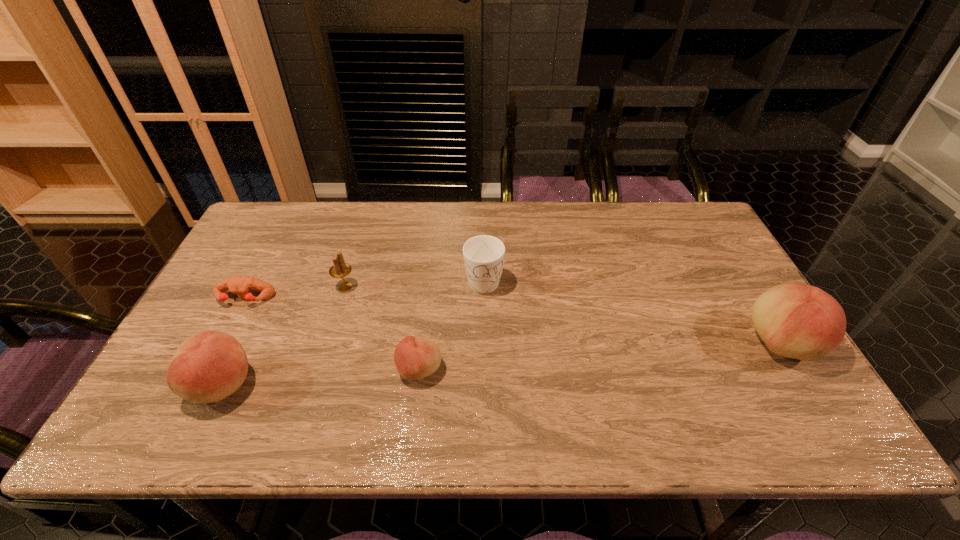
The width and height of the screenshot is (960, 540). Identify the location of vacant space that satisfies the following two spatial constraints: 1. with the gloves of the shortest peach facing forward; 2. on the right side of the shortest object. (207, 370).

What are the coordinates of `free space that satisfies the following two spatial constraints: 1. on the back side of the third object from right to left; 2. on the left side of the second tallest peach` in the screenshot? It's located at (230, 370).